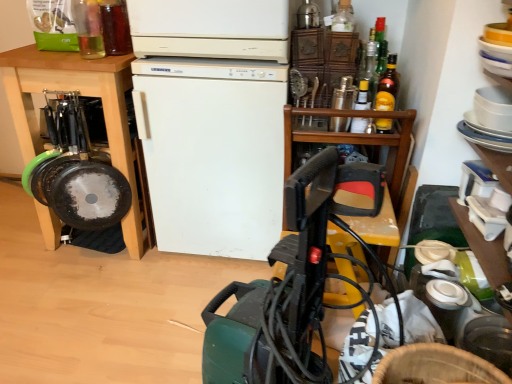
Question: Considering the positions of translucent glass bottle at upper right, which is the 2th bottle from right to left, and white matte refrigerator at center in the image, is translucent glass bottle at upper right, which is the 2th bottle from right to left, bigger or smaller than white matte refrigerator at center?

Choices:
 (A) small
 (B) big

Answer: (A)

Question: Looking at their shapes, would you say translucent glass bottle at upper right, which is the 2th bottle from right to left, is wider or thinner than white matte refrigerator at center?

Choices:
 (A) thin
 (B) wide

Answer: (A)

Question: Estimate the real-world distances between objects in this image. Which object is closer to the translucent glass bottle at upper right, which is the 2th bottle from right to left?

Choices:
 (A) yellow glass bottle at upper center, the 4th bottle when ordered from left to right
 (B) clear glass bottle at upper left, which appears as the first bottle when viewed from the left
 (C) white matte refrigerator at center
 (D) metallic silver shaker at upper right, which ranks as the 4th bottle in right-to-left order
 (E) green plastic vacuum cleaner at center

Answer: (A)

Question: Which object is the closest to the clear glass bottle at upper left, which appears as the first bottle when viewed from the left?

Choices:
 (A) green plastic vacuum cleaner at center
 (B) yellow glass bottle at upper right, arranged as the 6th bottle when viewed from the left
 (C) translucent glass bottle at upper right, which is the 2th bottle from right to left
 (D) wooden cabinet at left
 (E) white matte refrigerator at center

Answer: (D)